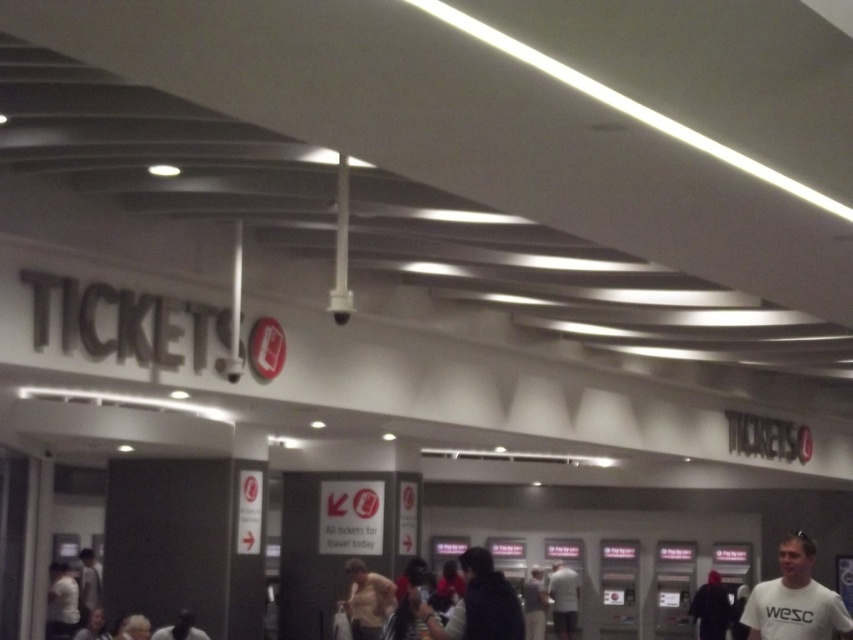
You are standing at the entrance of the ticketing area and want to locate two specific points marked on the floor. The first point is at coordinates point (x=351, y=579) and the second is at point (x=96, y=586). Which point is closer to you as you face the ticket vending machines?

Point (x=351, y=579) is closer to the camera than point (x=96, y=586), so when facing the ticket vending machines, point (x=351, y=579) will be closer to you.

You are a customer in the ticketing area and need to choose between the light beige shirt at center and the light gray shirt at lower left. Which one is narrower?

The light beige shirt at center is thinner than the light gray shirt at lower left, so the light beige shirt at center is narrower.